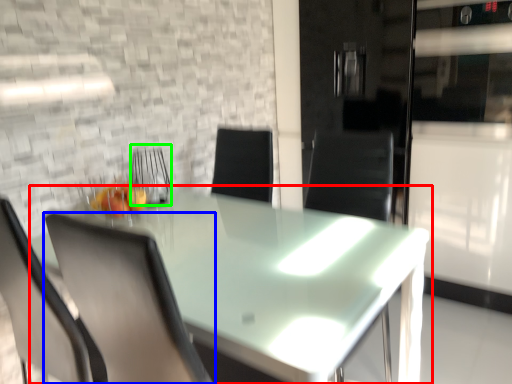
Question: Considering the real-world distances, which object is farthest from table (highlighted by a red box)? chair (highlighted by a blue box) or armchair (highlighted by a green box)?

Choices:
 (A) chair
 (B) armchair

Answer: (B)